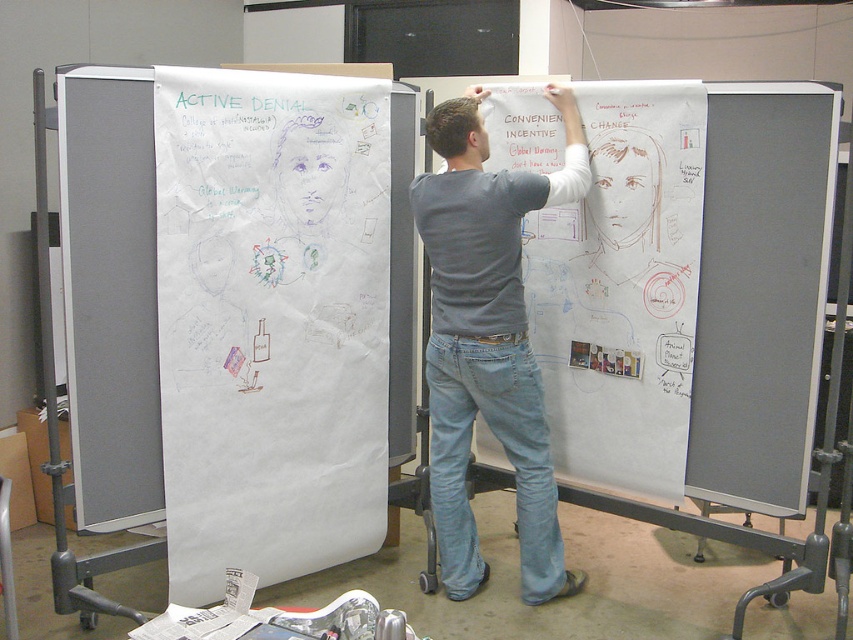
You are a person trying to hang a new poster on the wall. The poster is the same size as the white paperboard at center. Can you hang it above the gray cotton shirt at center without the poster being taller than the shirt?

The white paperboard at center is not as tall as gray cotton shirt at center, so yes, you can hang the poster above the gray cotton shirt at center without it being taller than the shirt.

You are an interior designer planning to place a 30 inch wide sofa between the white paper at left and the white paperboard at center. Based on the scene description, will the sofa fit in the space between them?

The white paper at left and white paperboard at center are 29.40 inches apart. Since the sofa is 30 inches wide, it will not fit in the space between them as the distance is slightly less than the sofa width.